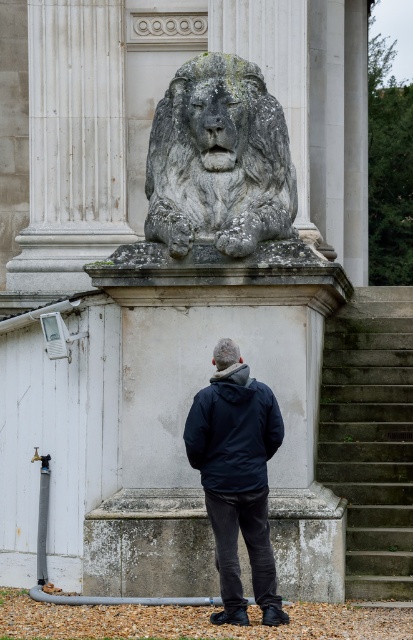
You are standing at the bottom of the gray concrete stairs at lower right and want to approach the gray stone lion at center. Which direction should you move to reach it?

You should move forward towards the gray stone lion at center because the gray concrete stairs at lower right are closer to you, so moving forward will take you towards the lion.

You are a photographer standing in front of the classical building and want to take a photo of the large stone lion statue. However, there are two men wearing jackets in the foreground. The first man wears a dark blue jacket at center, and the second wears a navy blue jacket at center. Which jacket is closer to you, the photographer, so you can decide whether to ask them to move?

The dark blue jacket at center is closer to you than the navy blue jacket at center, so you should ask the person wearing the dark blue jacket at center to move first to get an unobstructed view of the lion statue.